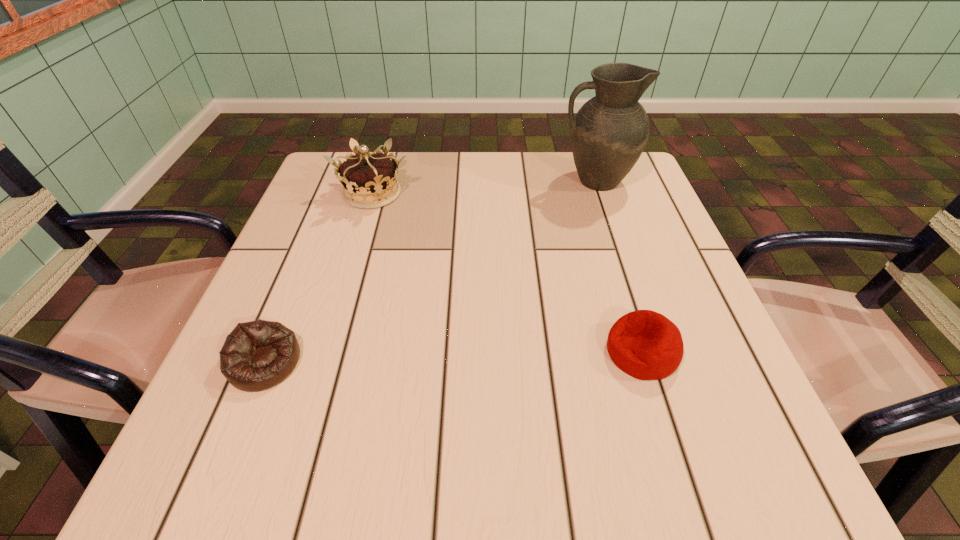
I want to click on unoccupied area between the tallest object and the shorter beanbag, so click(430, 272).

Where is `empty space between the taller beanbag and the pitcher`? The width and height of the screenshot is (960, 540). empty space between the taller beanbag and the pitcher is located at coordinates (619, 266).

Locate an element on the screen. vacant area that lies between the left beanbag and the tallest object is located at coordinates 430,272.

Identify the location of vacant point located between the shortest object and the pitcher. Image resolution: width=960 pixels, height=540 pixels. (430, 272).

Find the location of a particular element. This screenshot has height=540, width=960. free space between the left beanbag and the second tallest object is located at coordinates (319, 278).

At what (x,y) coordinates should I click in order to perform the action: click on unoccupied position between the tallest object and the left beanbag. Please return your answer as a coordinate pair (x, y). The height and width of the screenshot is (540, 960). Looking at the image, I should click on (430, 272).

The height and width of the screenshot is (540, 960). Find the location of `free space between the crown and the tallest object`. free space between the crown and the tallest object is located at coordinates (484, 187).

At what (x,y) coordinates should I click in order to perform the action: click on vacant space that is in between the right beanbag and the crown. Please return your answer as a coordinate pair (x, y). Looking at the image, I should click on tap(507, 273).

Locate an element on the screen. Image resolution: width=960 pixels, height=540 pixels. free space between the third tallest object and the crown is located at coordinates (507, 273).

This screenshot has height=540, width=960. In order to click on the third closest object to the crown in this screenshot , I will do point(646,345).